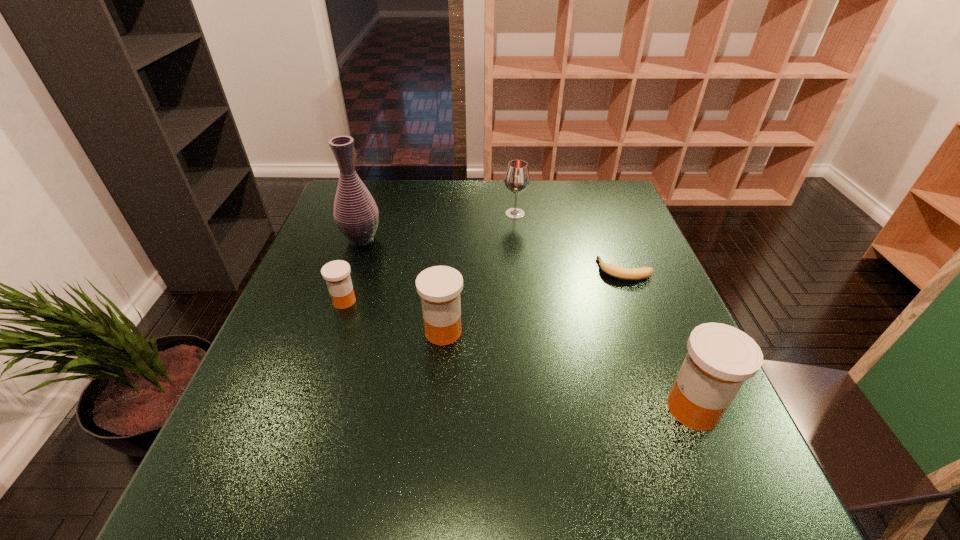
In order to click on the shortest medicine in this screenshot , I will do `click(336, 273)`.

Where is `the leftmost medicine`? This screenshot has width=960, height=540. the leftmost medicine is located at coordinates (336, 273).

Where is `the fourth object from right to left`? This screenshot has width=960, height=540. the fourth object from right to left is located at coordinates (439, 287).

Where is `the second tallest medicine`? the second tallest medicine is located at coordinates (439, 287).

In order to click on the nearest object in this screenshot , I will do `click(720, 358)`.

At what (x,y) coordinates should I click in order to perform the action: click on the rightmost medicine. Please return your answer as a coordinate pair (x, y). This screenshot has height=540, width=960. Looking at the image, I should click on (720, 358).

I want to click on the farthest object, so click(517, 179).

Image resolution: width=960 pixels, height=540 pixels. What are the coordinates of `wineglass` in the screenshot? It's located at (517, 179).

The image size is (960, 540). Identify the location of the second farthest object. (356, 214).

At what (x,y) coordinates should I click in order to perform the action: click on the tallest object. Please return your answer as a coordinate pair (x, y). This screenshot has height=540, width=960. Looking at the image, I should click on (356, 214).